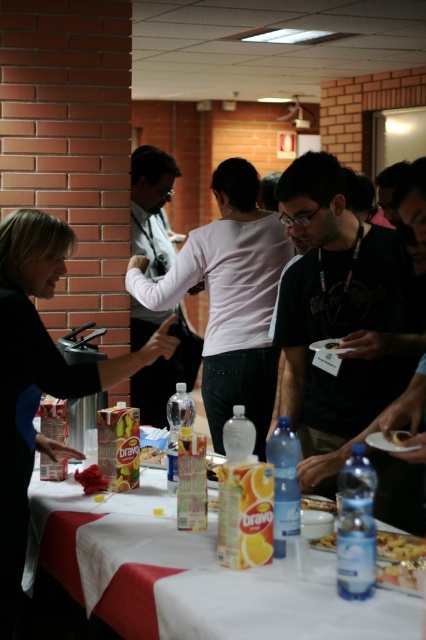
Question: Which object appears closest to the camera in this image?

Choices:
 (A) smooth chocolate bar at center
 (B) white paper table at center
 (C) golden crispy pizza at lower right

Answer: (B)

Question: Which object is closer to the camera taking this photo?

Choices:
 (A) white paper plate at center
 (B) black fabric shirt at left
 (C) white paper table at center

Answer: (C)

Question: From the image, what is the correct spatial relationship of black fabric shirt at left in relation to orange juice carton at table center?

Choices:
 (A) above
 (B) below

Answer: (A)

Question: Is white paper table at center above golden crispy pizza at lower right?

Choices:
 (A) no
 (B) yes

Answer: (A)

Question: Which point is closer to the camera?

Choices:
 (A) black fabric shirt at left
 (B) smooth chocolate bar at center
 (C) golden crispy pizza at lower right

Answer: (C)

Question: Does golden crispy pizza at lower right appear over white paper plate at center?

Choices:
 (A) yes
 (B) no

Answer: (B)